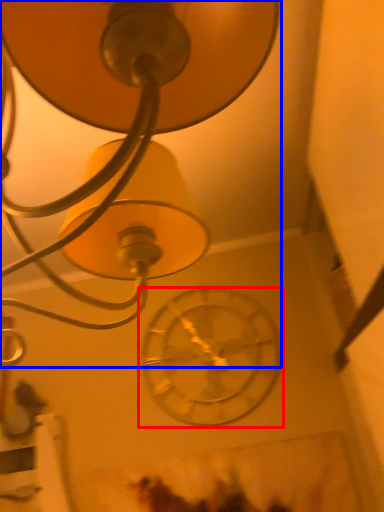
Question: Which object is further to the camera taking this photo, wall clock (highlighted by a red box) or lamp (highlighted by a blue box)?

Choices:
 (A) wall clock
 (B) lamp

Answer: (A)